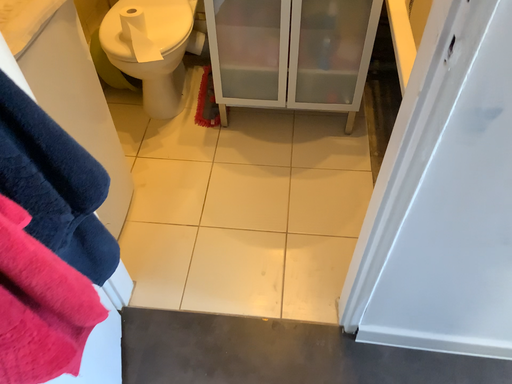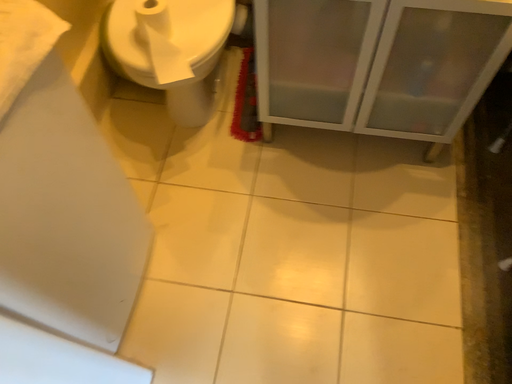
Question: Which way did the camera rotate in the video?

Choices:
 (A) rotated upward
 (B) rotated downward

Answer: (B)